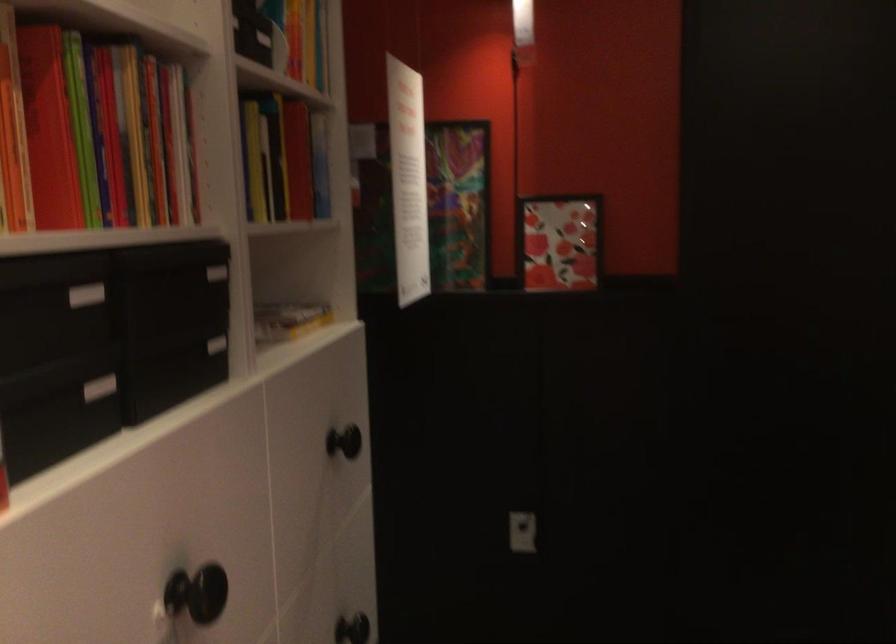
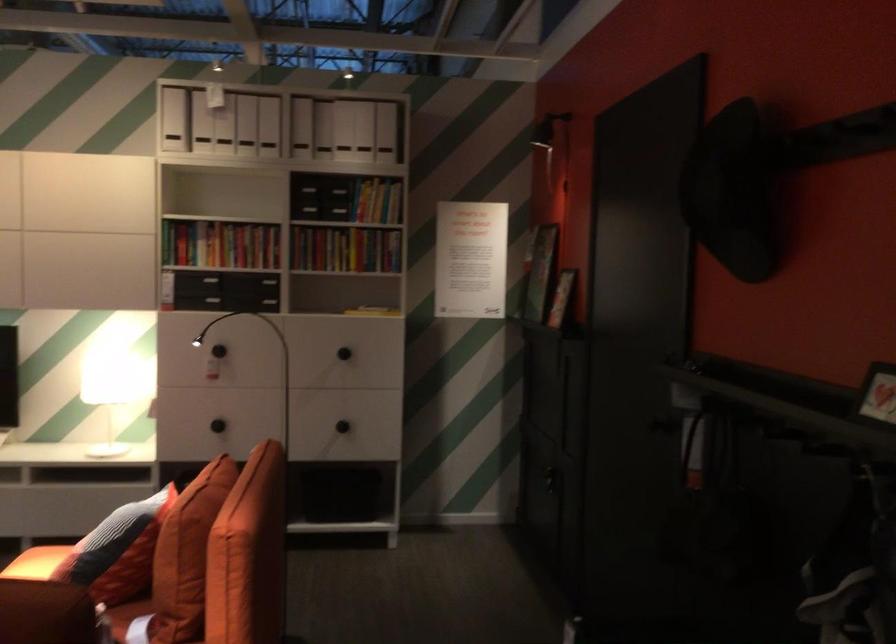
Where in the second image is the point corresponding to [291,192] from the first image?

(345, 249)